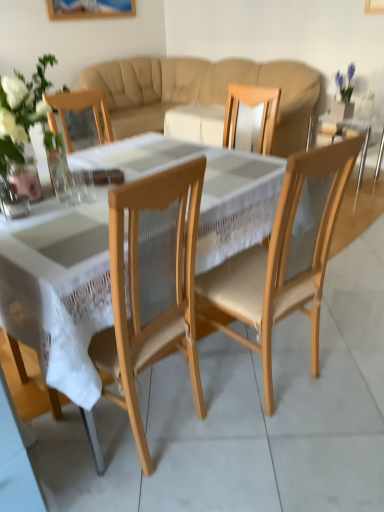
Find the location of a particular element. This screenshot has width=384, height=512. space that is in front of transparent glass at center, the 2th tableware in the left-to-right sequence is located at coordinates (71, 220).